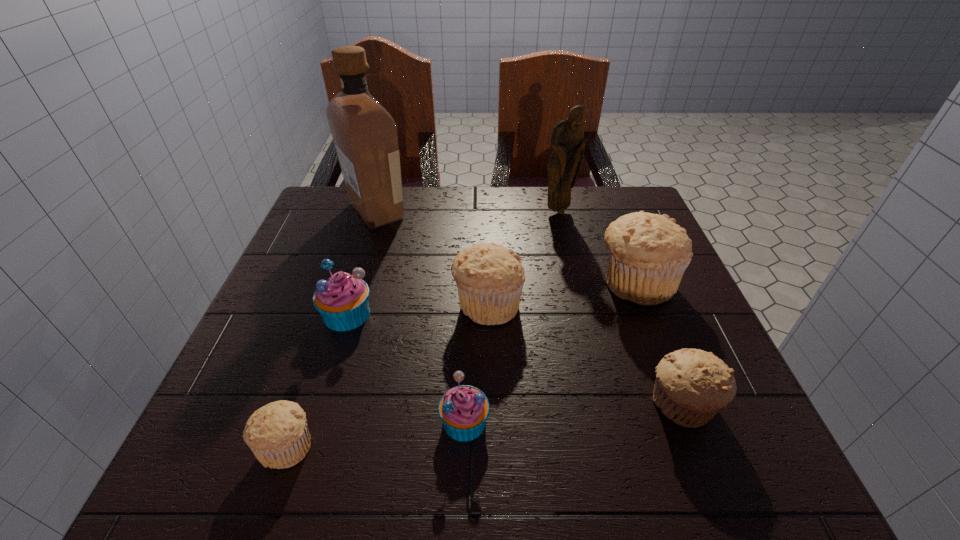
Locate which beige muffin is the third closest to the right blue muffin. Please provide its 2D coordinates. Your answer should be formatted as a tuple, i.e. [(x, y)], where the tuple contains the x and y coordinates of a point satisfying the conditions above.

[(692, 385)]

This screenshot has width=960, height=540. What are the coordinates of `vacant region that satisfies the following two spatial constraints: 1. on the front-facing side of the sixth object from left to right; 2. on the right side of the third tallest object` in the screenshot? It's located at (575, 283).

At what (x,y) coordinates should I click in order to perform the action: click on free space that satisfies the following two spatial constraints: 1. on the back side of the right blue muffin; 2. on the front-facing side of the brown liquor. Please return your answer as a coordinate pair (x, y). Looking at the image, I should click on (470, 211).

The height and width of the screenshot is (540, 960). In order to click on vacant area that satisfies the following two spatial constraints: 1. on the front-facing side of the third smallest beige muffin; 2. on the right side of the tallest object in this screenshot , I will do `click(348, 304)`.

Image resolution: width=960 pixels, height=540 pixels. I want to click on vacant point that satisfies the following two spatial constraints: 1. on the front-facing side of the brown liquor; 2. on the left side of the right blue muffin, so click(x=312, y=421).

Locate an element on the screen. The image size is (960, 540). free space that satisfies the following two spatial constraints: 1. on the back side of the smallest beige muffin; 2. on the right side of the right blue muffin is located at coordinates (295, 421).

You are a GUI agent. You are given a task and a screenshot of the screen. Output one action in this format:
    pyautogui.click(x=<x>, y=<y>)
    Task: Click on the vacant area in the image that satisfies the following two spatial constraints: 1. on the front-facing side of the sixth object from left to right; 2. on the left side of the tallest muffin
    The image size is (960, 540).
    Given the screenshot: What is the action you would take?
    pyautogui.click(x=575, y=283)